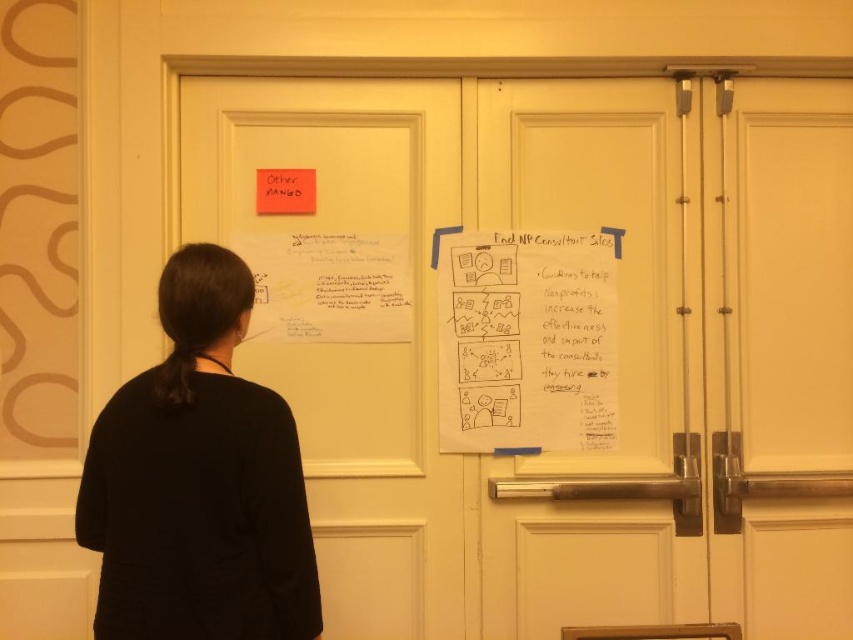
Who is positioned more to the right, white paper at upper left or black fabric at left?

Positioned to the right is white paper at upper left.

The height and width of the screenshot is (640, 853). Describe the element at coordinates (350, 342) in the screenshot. I see `white paper at upper left` at that location.

The image size is (853, 640). Find the location of `white paper at upper left`. white paper at upper left is located at coordinates (350, 342).

Between white matte door at center and black fabric at left, which one is positioned lower?

black fabric at left is below.

Find the location of a particular element. white matte door at center is located at coordinates (781, 355).

Image resolution: width=853 pixels, height=640 pixels. What are the coordinates of `white matte door at center` in the screenshot? It's located at (781, 355).

Locate an element on the screen. white matte door at center is located at coordinates (781, 355).

Is white paper at right positioned behind black fabric at left?

Yes, white paper at right is further from the viewer.

Between white paper at right and black fabric at left, which one appears on the right side from the viewer's perspective?

white paper at right

Between point (579, 614) and point (109, 486), which one is positioned in front?

Point (109, 486) is in front.

You are a GUI agent. You are given a task and a screenshot of the screen. Output one action in this format:
    pyautogui.click(x=<x>, y=<y>)
    Task: Click on the white paper at right
    
    Given the screenshot: What is the action you would take?
    click(x=618, y=360)